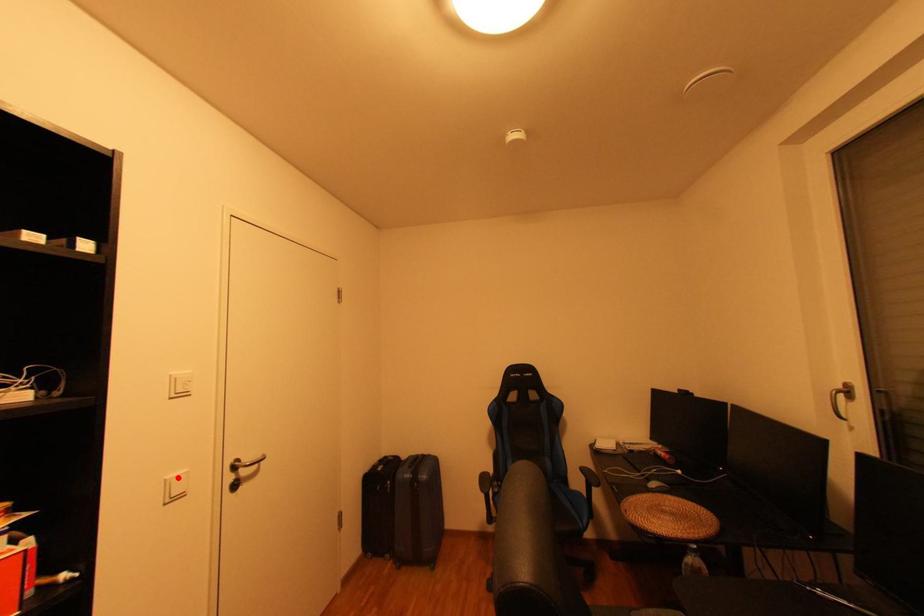
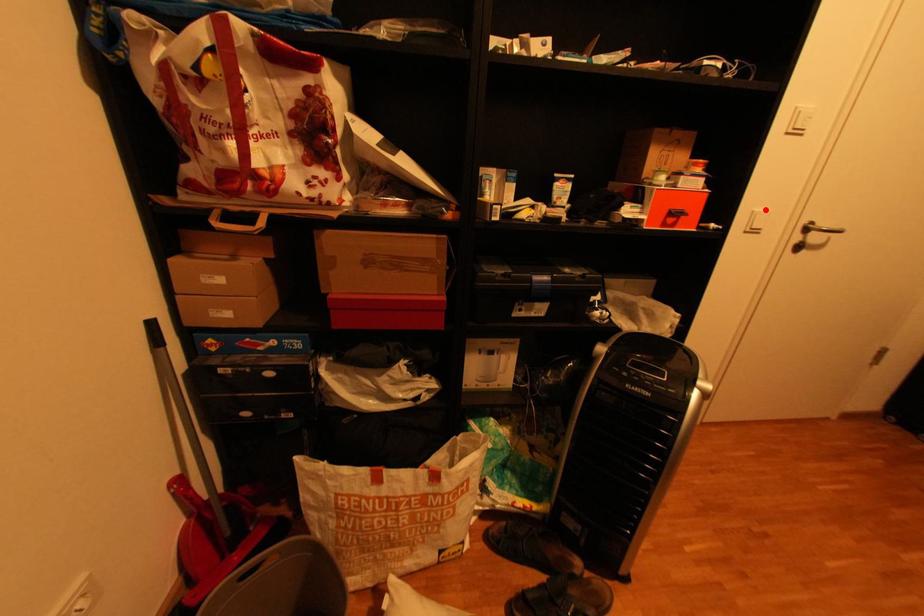
I am providing you with two images of the same scene from different viewpoints. A red point is marked on the first image and another point is marked on the second image. Are the points marked in image1 and image2 representing the same 3D position?

Yes